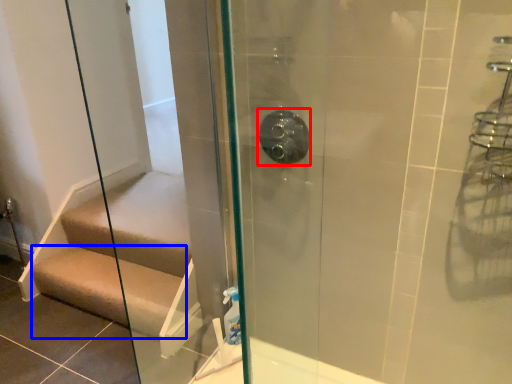
Question: Which of the following is the closest to the observer, shower (highlighted by a red box) or stairs (highlighted by a blue box)?

Choices:
 (A) shower
 (B) stairs

Answer: (A)